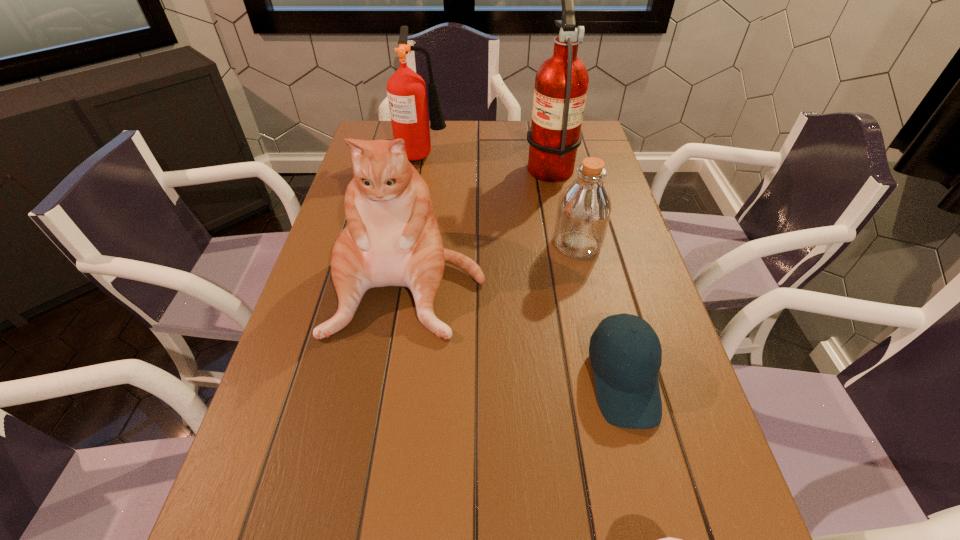
What are the coordinates of `free space that satisfies the following two spatial constraints: 1. on the back side of the fourth tallest object; 2. at the nozzle of the shorter fire extinguisher` in the screenshot? It's located at (556, 153).

Find the location of a particular element. The height and width of the screenshot is (540, 960). free location that satisfies the following two spatial constraints: 1. on the back side of the bottle; 2. on the nozzle and handle of the tallest object is located at coordinates (559, 164).

This screenshot has height=540, width=960. Find the location of `vacant space that satisfies the following two spatial constraints: 1. at the nozzle of the left fire extinguisher; 2. on the right side of the bottle`. vacant space that satisfies the following two spatial constraints: 1. at the nozzle of the left fire extinguisher; 2. on the right side of the bottle is located at coordinates pos(407,244).